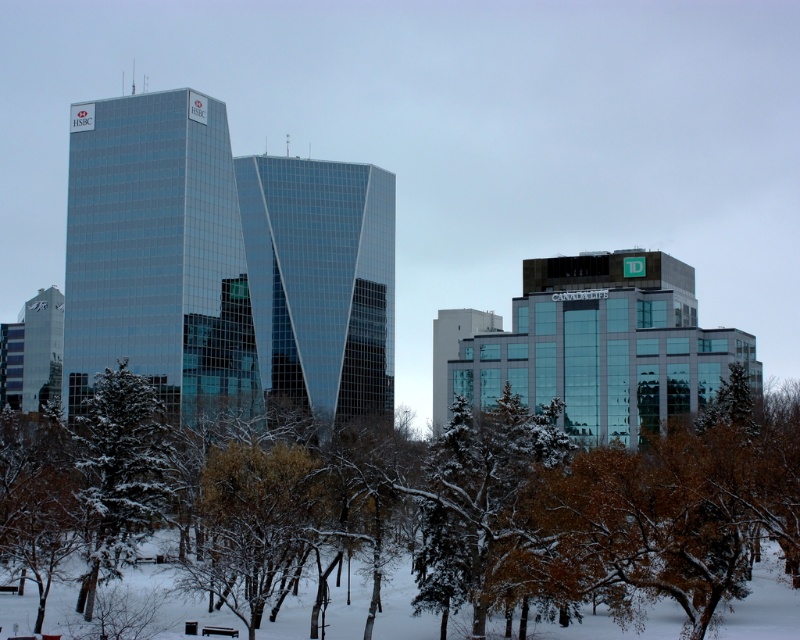
Question: Which point appears farthest from the camera in this image?

Choices:
 (A) (186, 100)
 (B) (628, 426)
 (C) (338, 486)

Answer: (B)

Question: Is glassy blue skyscraper at left smaller than transparent glass skyscraper at center?

Choices:
 (A) yes
 (B) no

Answer: (A)

Question: Which point appears farthest from the camera in this image?

Choices:
 (A) (28, 406)
 (B) (638, 266)

Answer: (A)

Question: Is transparent glass skyscraper at center above green matte tree at lower left?

Choices:
 (A) no
 (B) yes

Answer: (B)

Question: Is green matte tree at lower left to the right of matte glass building at center from the viewer's perspective?

Choices:
 (A) yes
 (B) no

Answer: (A)

Question: Among these points, which one is nearest to the camera?

Choices:
 (A) (656, 310)
 (B) (274, 344)
 (C) (116, 403)
 (D) (72, 452)

Answer: (C)